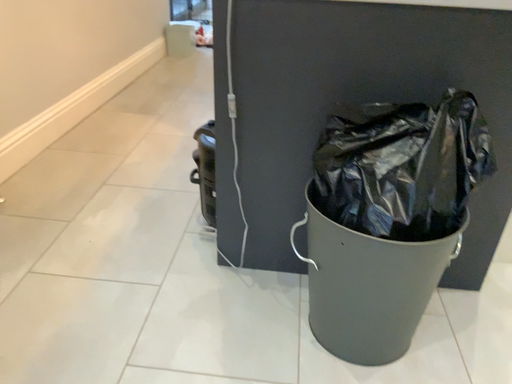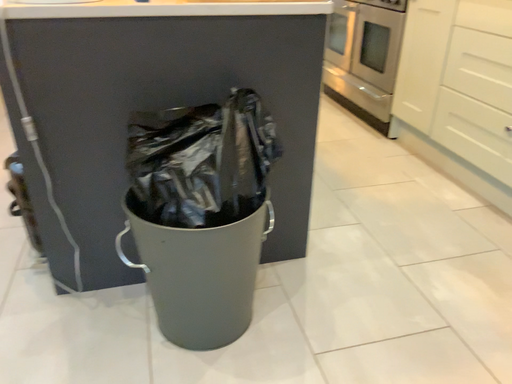
Question: Which way did the camera rotate in the video?

Choices:
 (A) rotated left
 (B) rotated right

Answer: (B)